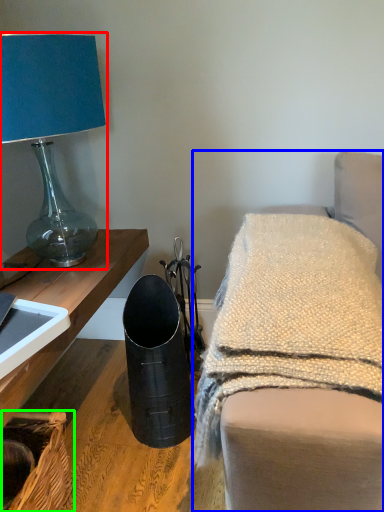
Question: Which object is the closest to the lamp (highlighted by a red box)? Choose among these: furniture (highlighted by a blue box) or basket (highlighted by a green box).

Choices:
 (A) furniture
 (B) basket

Answer: (A)